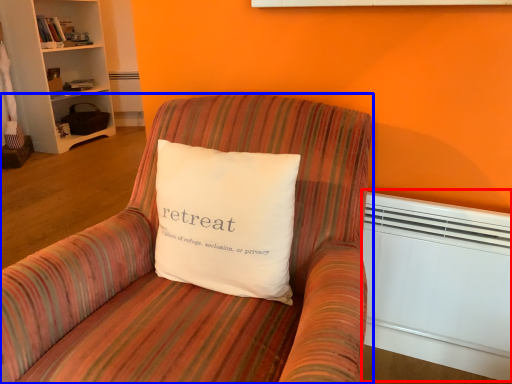
Question: Which of the following is the farthest to the observer, heater (highlighted by a red box) or chair (highlighted by a blue box)?

Choices:
 (A) heater
 (B) chair

Answer: (A)